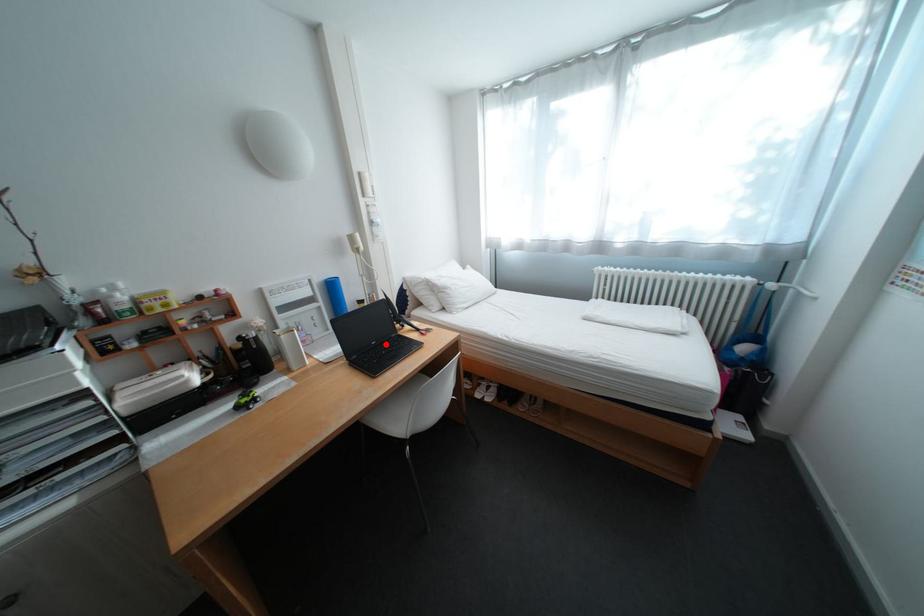
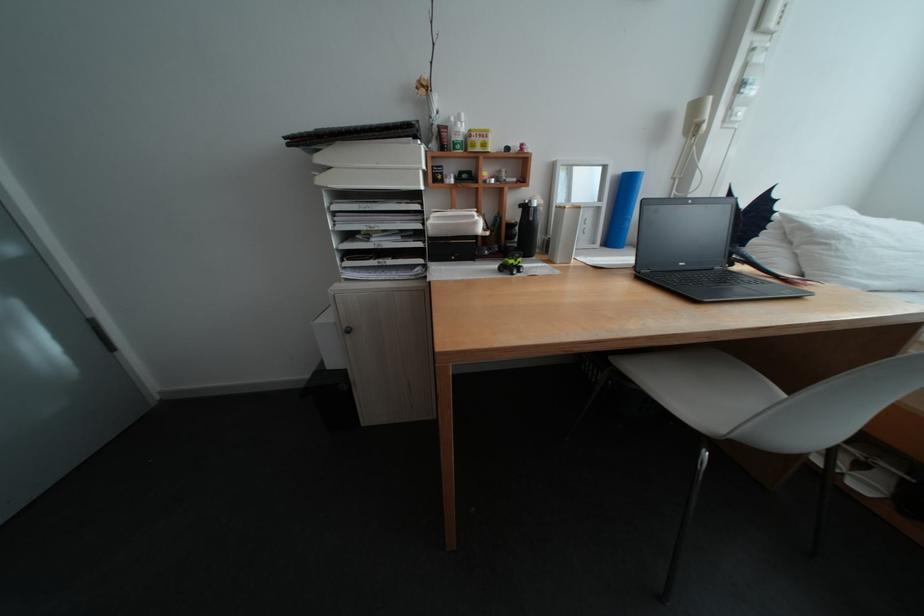
In the second image, find the point that corresponds to the highlighted location in the first image.

(694, 265)